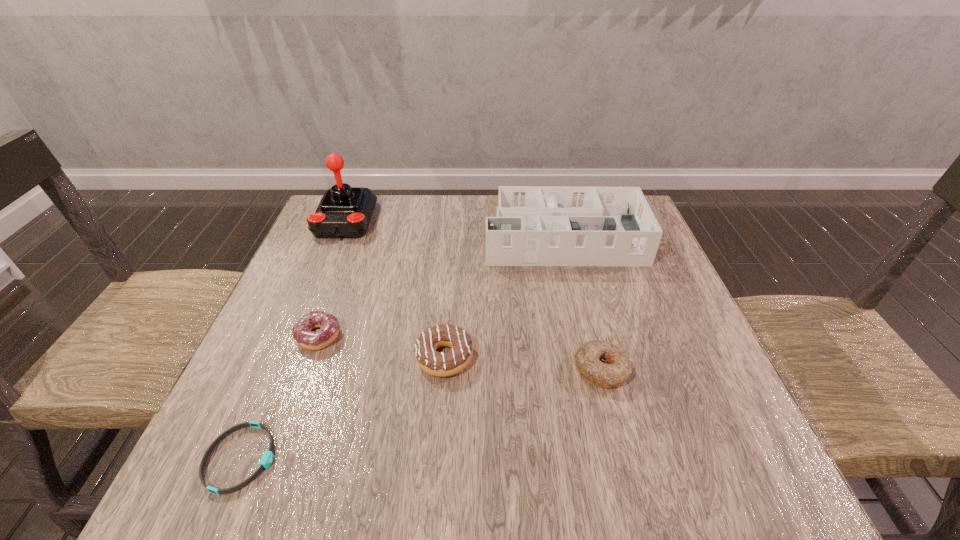
Find the location of a particular element. joystick is located at coordinates (344, 212).

Locate an element on the screen. dollhouse is located at coordinates (535, 225).

The width and height of the screenshot is (960, 540). I want to click on the second doughnut from right to left, so click(x=435, y=363).

Identify the location of the rightmost doughnut. (602, 364).

Identify the location of the leftmost doughnut. This screenshot has width=960, height=540. (329, 326).

Identify the location of wristband. This screenshot has height=540, width=960. (267, 458).

I want to click on the shortest object, so click(267, 458).

Find the location of `vacant region located 0.270m on the base of the tallest object`. vacant region located 0.270m on the base of the tallest object is located at coordinates (304, 322).

The image size is (960, 540). I want to click on vacant space located on the front of the dollhouse, so click(x=580, y=311).

Where is `vacant space positioned 0.180m on the left of the second doughnut from left to right`? The height and width of the screenshot is (540, 960). vacant space positioned 0.180m on the left of the second doughnut from left to right is located at coordinates (324, 357).